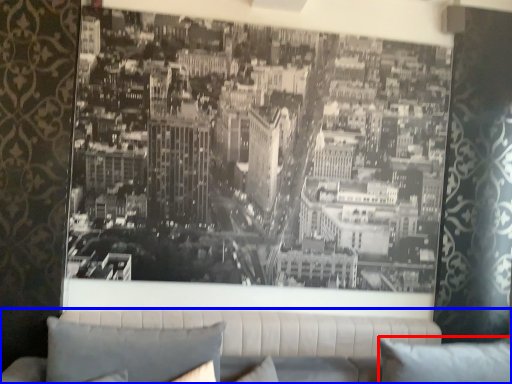
Question: Which of the following is the closest to the observer, pillow (highlighted by a red box) or studio couch (highlighted by a blue box)?

Choices:
 (A) pillow
 (B) studio couch

Answer: (A)